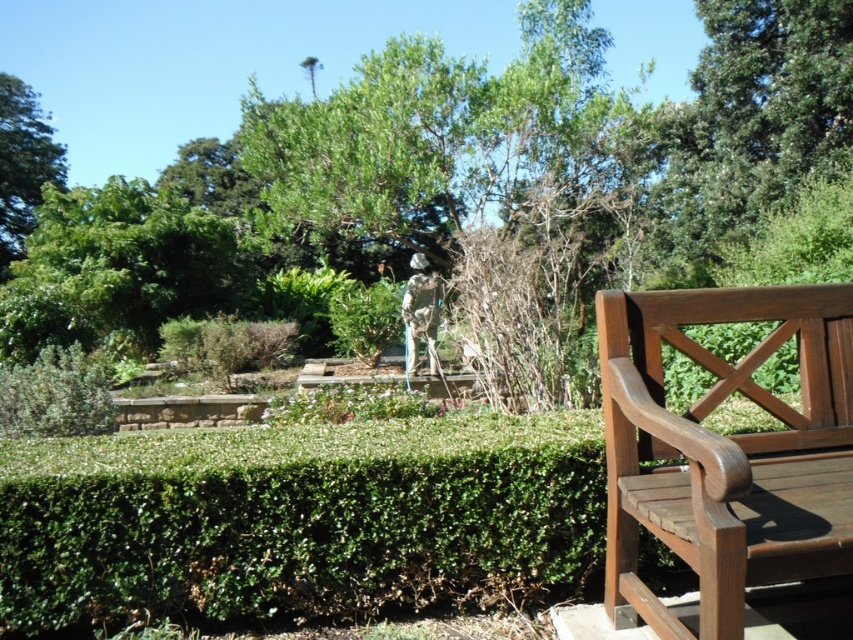
You are standing in the garden and want to sit down on the dark brown wood bench at right. To your left, there is a green leafy tree at center. When you face the bench, which side of the bench is closer to the tree?

The left side of the dark brown wood bench at right is closer to the green leafy tree at center since the tree is positioned to the left of the bench.

You are standing at the center of the garden and want to sit on the dark brown wood bench at right. According to the coordinates given, in which direction should you walk to reach the bench?

The dark brown wood bench at right is located at coordinates point [726,451]. Since you are at the center, you should walk towards the right and slightly forward to reach the bench.